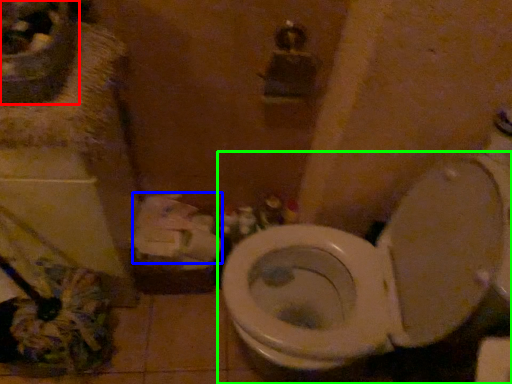
Question: Estimate the real-world distances between objects in this image. Which object is closer to sink (highlighted by a red box), toilet paper (highlighted by a blue box) or toilet (highlighted by a green box)?

Choices:
 (A) toilet paper
 (B) toilet

Answer: (A)